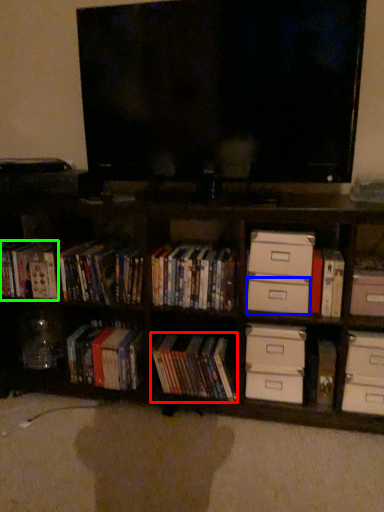
Question: Considering the real-world distances, which object is farthest from book (highlighted by a red box)? drawer (highlighted by a blue box) or book (highlighted by a green box)?

Choices:
 (A) drawer
 (B) book

Answer: (B)